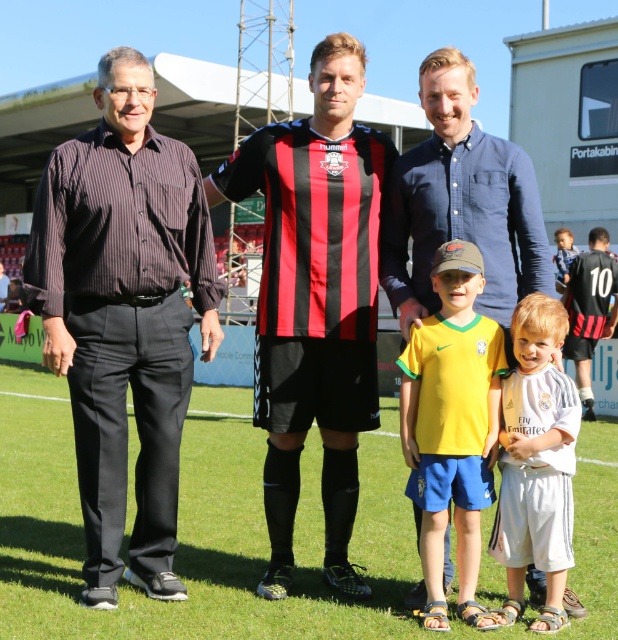
You are a photographer trying to capture a clear shot of both the blue cotton shirt at center and the yellow jersey at center. Which one is positioned higher in the frame?

The blue cotton shirt at center is located above the yellow jersey at center, so it is positioned higher in the frame.